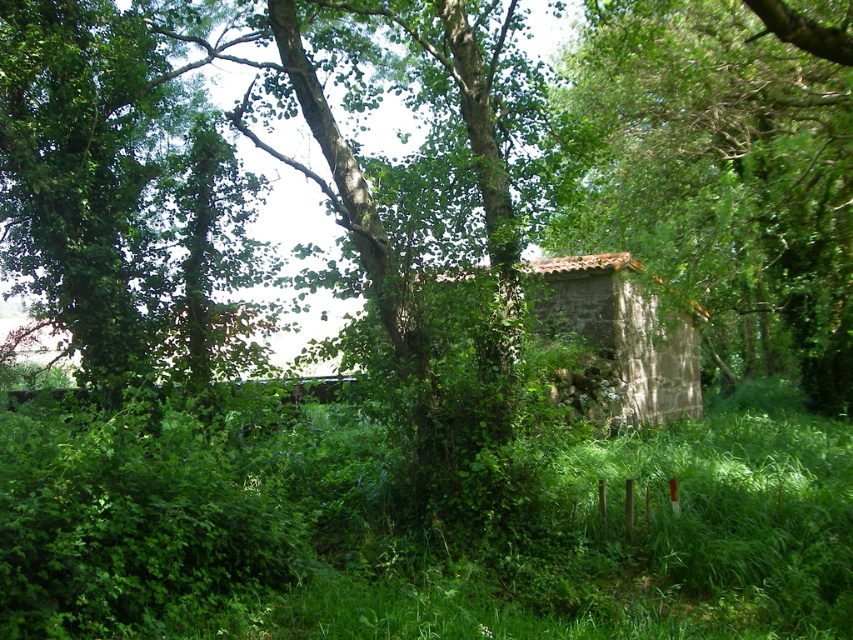
Who is shorter, green leafy grass at center or green leafy tree at center?

Standing shorter between the two is green leafy grass at center.

How far apart are green leafy grass at center and green leafy tree at center?

green leafy grass at center and green leafy tree at center are 21.96 feet apart.

Does point (286, 568) come behind point (674, 22)?

No.

The image size is (853, 640). I want to click on green leafy grass at center, so click(421, 532).

Can you confirm if green leafy grass at center is positioned to the right of stone textured hut at center?

In fact, green leafy grass at center is to the left of stone textured hut at center.

Can you confirm if green leafy grass at center is bigger than stone textured hut at center?

Indeed, green leafy grass at center has a larger size compared to stone textured hut at center.

Describe the element at coordinates (421, 532) in the screenshot. The height and width of the screenshot is (640, 853). I see `green leafy grass at center` at that location.

This screenshot has width=853, height=640. In order to click on green leafy grass at center in this screenshot , I will do tap(421, 532).

Can you confirm if green leafy tree at center is bigger than stone textured hut at center?

Indeed, green leafy tree at center has a larger size compared to stone textured hut at center.

What do you see at coordinates (718, 176) in the screenshot?
I see `green leafy tree at center` at bounding box center [718, 176].

Identify the location of green leafy tree at center. (718, 176).